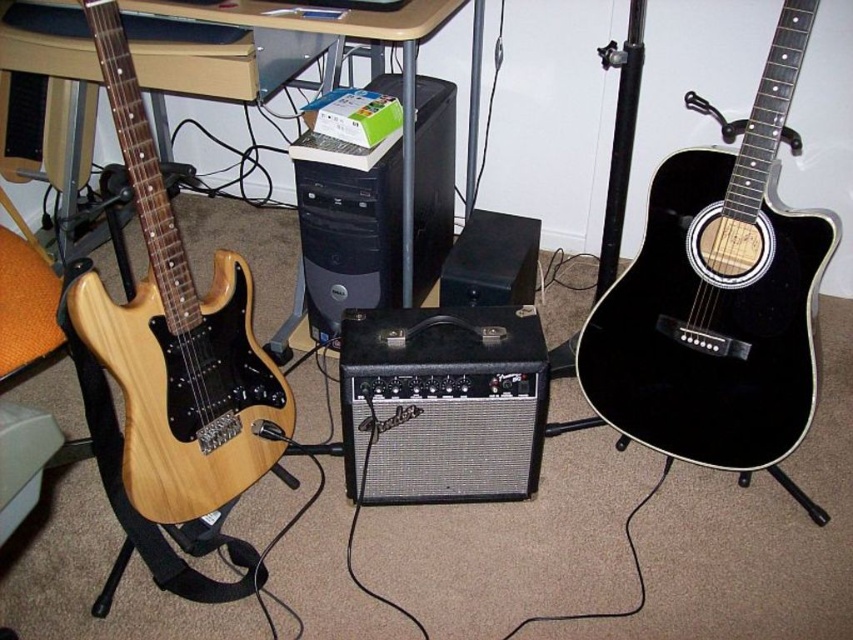
Is natural wood electric guitar at left behind black matte speaker at center?

No.

Can you confirm if natural wood electric guitar at left is shorter than black matte speaker at center?

In fact, natural wood electric guitar at left may be taller than black matte speaker at center.

I want to click on natural wood electric guitar at left, so click(x=177, y=339).

Can you confirm if black glossy acoustic guitar at right is shorter than black plastic computer tower at center?

No, black glossy acoustic guitar at right is not shorter than black plastic computer tower at center.

Which of these two, black glossy acoustic guitar at right or black plastic computer tower at center, stands shorter?

Standing shorter between the two is black plastic computer tower at center.

Describe the element at coordinates (717, 296) in the screenshot. I see `black glossy acoustic guitar at right` at that location.

Locate an element on the screen. black glossy acoustic guitar at right is located at coordinates (717, 296).

Is point (593, 364) positioned before point (141, 381)?

That is False.

At what (x,y) coordinates should I click in order to perform the action: click on black glossy acoustic guitar at right. Please return your answer as a coordinate pair (x, y). Looking at the image, I should click on (717, 296).

Find the location of a particular element. The height and width of the screenshot is (640, 853). black glossy acoustic guitar at right is located at coordinates (717, 296).